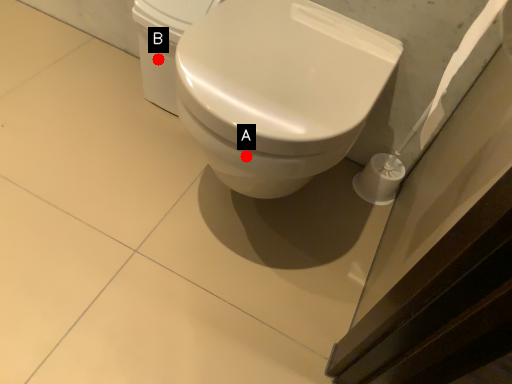
Question: Two points are circled on the image, labeled by A and B beside each circle. Which of the following is the closest to the observer?

Choices:
 (A) A is closer
 (B) B is closer

Answer: (A)